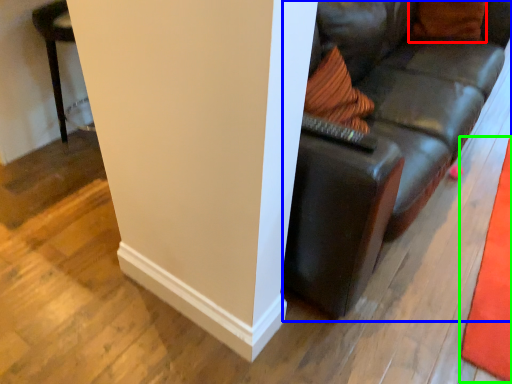
Question: Estimate the real-world distances between objects in this image. Which object is closer to pillow (highlighted by a red box), studio couch (highlighted by a blue box) or mat (highlighted by a green box)?

Choices:
 (A) studio couch
 (B) mat

Answer: (A)